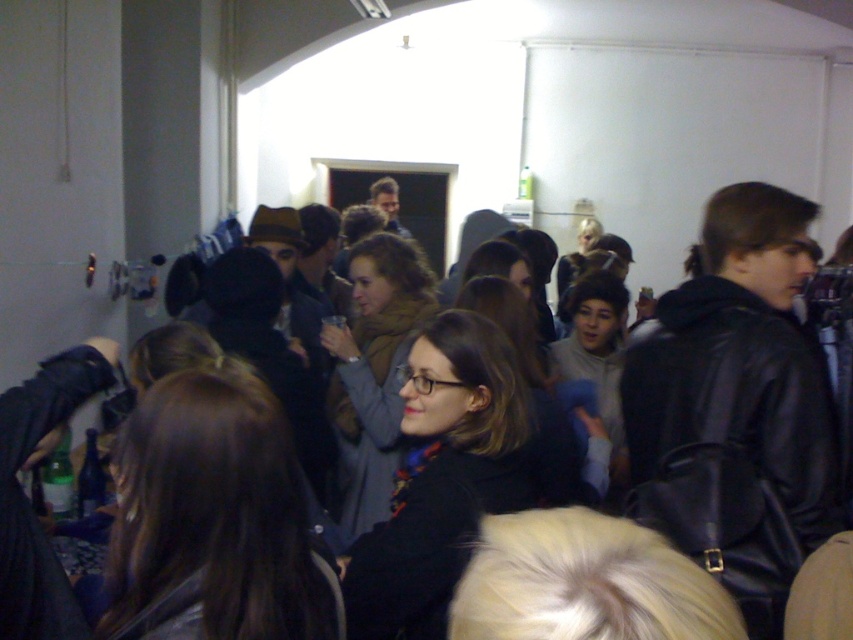
Who is shorter, brown hair at center or matte brown scarf at center?

brown hair at center is shorter.

Can you confirm if brown hair at center is bigger than matte brown scarf at center?

No.

Where is `brown hair at center`? The height and width of the screenshot is (640, 853). brown hair at center is located at coordinates (213, 518).

Between point (367, 596) and point (368, 497), which one is positioned behind?

Positioned behind is point (368, 497).

The height and width of the screenshot is (640, 853). What do you see at coordinates (442, 477) in the screenshot?
I see `matte black coat at center` at bounding box center [442, 477].

In order to click on matte black coat at center in this screenshot , I will do pyautogui.click(x=442, y=477).

Consider the image. Can you confirm if brown hair at center is bigger than matte black coat at center?

Actually, brown hair at center might be smaller than matte black coat at center.

From the picture: Who is positioned more to the right, brown hair at center or matte black coat at center?

matte black coat at center

The width and height of the screenshot is (853, 640). Describe the element at coordinates (213, 518) in the screenshot. I see `brown hair at center` at that location.

At what (x,y) coordinates should I click in order to perform the action: click on brown hair at center. Please return your answer as a coordinate pair (x, y). Image resolution: width=853 pixels, height=640 pixels. Looking at the image, I should click on [213, 518].